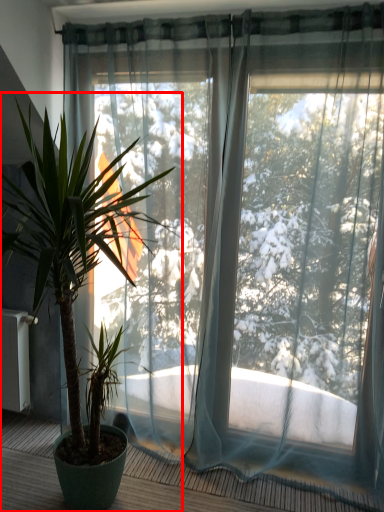
Question: From the image's perspective, where is houseplant (annotated by the red box) located in relation to balcony in the image?

Choices:
 (A) below
 (B) above

Answer: (B)